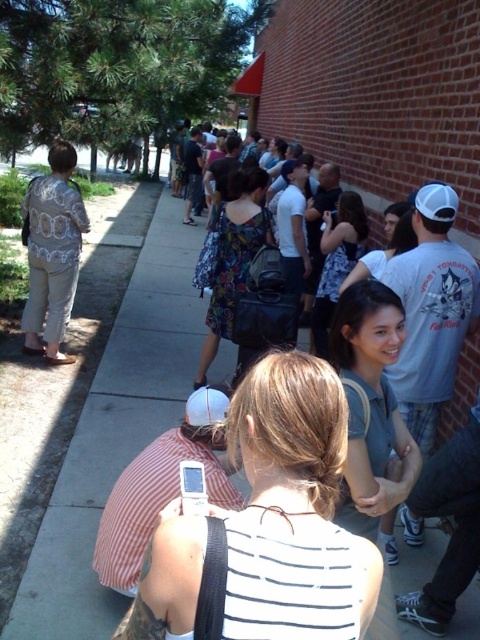
You are a photographer trying to capture both the white striped shirt at center and the light beige fabric dress at left in a single shot. Based on their sizes in the image, which one would you need to frame more carefully to ensure it appears detailed in the photo?

The white striped shirt at center is smaller than the light beige fabric dress at left, so you should frame the white striped shirt at center more carefully to ensure its details are captured clearly.

Based on the scene description, if someone is standing at the position of the white striped shirt at center, which direction would they need to look to see the light beige fabric dress at left?

The white striped shirt at center is located below the light beige fabric dress at left, so the person would need to look upward and to the left to see the light beige fabric dress at left.